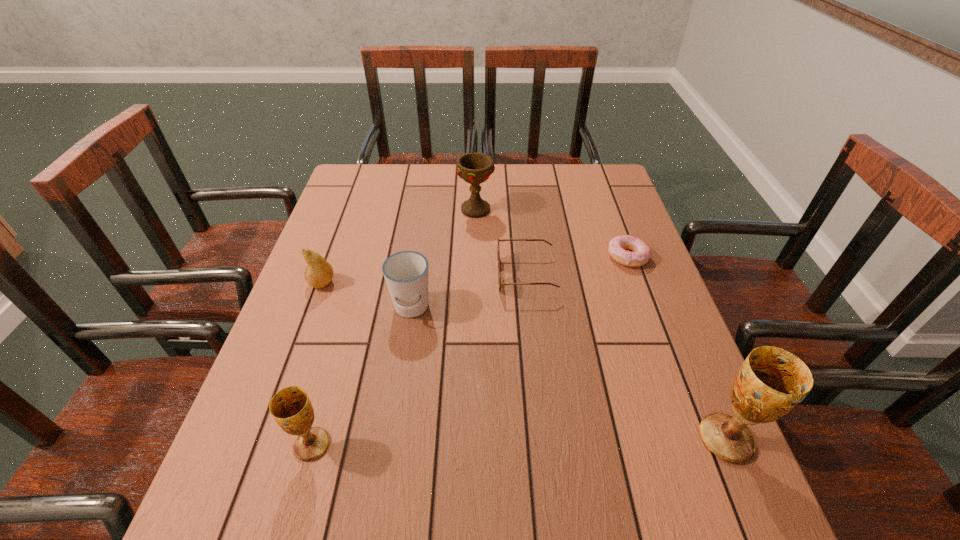
Locate an element on the screen. vacant area located 0.090m on the back of the sixth object from right to left is located at coordinates (328, 387).

At what (x,y) coordinates should I click in order to perform the action: click on vacant space located on the back of the tallest chalice. Please return your answer as a coordinate pair (x, y). The image size is (960, 540). Looking at the image, I should click on (670, 306).

Find the location of `free space located 0.350m on the front of the fourth object from left to right`. free space located 0.350m on the front of the fourth object from left to right is located at coordinates (475, 307).

You are a GUI agent. You are given a task and a screenshot of the screen. Output one action in this format:
    pyautogui.click(x=<x>, y=<y>)
    Task: Click on the free location located at the front view of the sixth tallest object
    The width and height of the screenshot is (960, 540).
    Given the screenshot: What is the action you would take?
    pyautogui.click(x=345, y=276)

At what (x,y) coordinates should I click in order to perform the action: click on vacant space situated at the front view of the sixth tallest object. Please return your answer as a coordinate pair (x, y). This screenshot has height=540, width=960. Looking at the image, I should click on (460, 276).

The height and width of the screenshot is (540, 960). Find the location of `free space located 0.200m at the front view of the sixth tallest object`. free space located 0.200m at the front view of the sixth tallest object is located at coordinates (421, 276).

I want to click on free space located 0.060m on the back of the pear, so click(x=331, y=259).

Where is `free space located 0.300m on the front of the shortest object`? free space located 0.300m on the front of the shortest object is located at coordinates (667, 365).

I want to click on vacant space located 0.280m with a handle on the side of the cup, so click(391, 444).

Locate an element on the screen. Image resolution: width=960 pixels, height=540 pixels. object that is at the far edge is located at coordinates (475, 168).